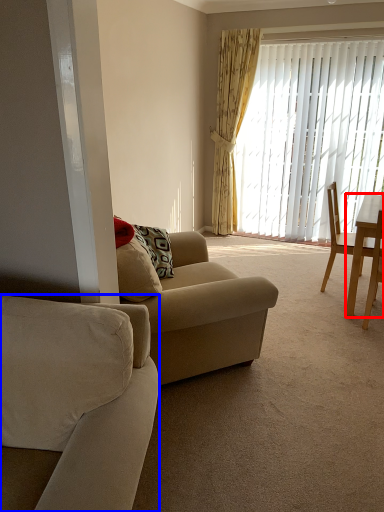
Question: Which point is closer to the camera, desk (highlighted by a red box) or studio couch (highlighted by a blue box)?

Choices:
 (A) desk
 (B) studio couch

Answer: (B)